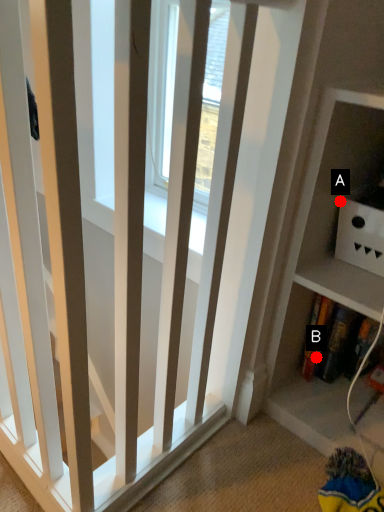
Question: Two points are circled on the image, labeled by A and B beside each circle. Which point appears farthest from the camera in this image?

Choices:
 (A) A is further
 (B) B is further

Answer: (B)